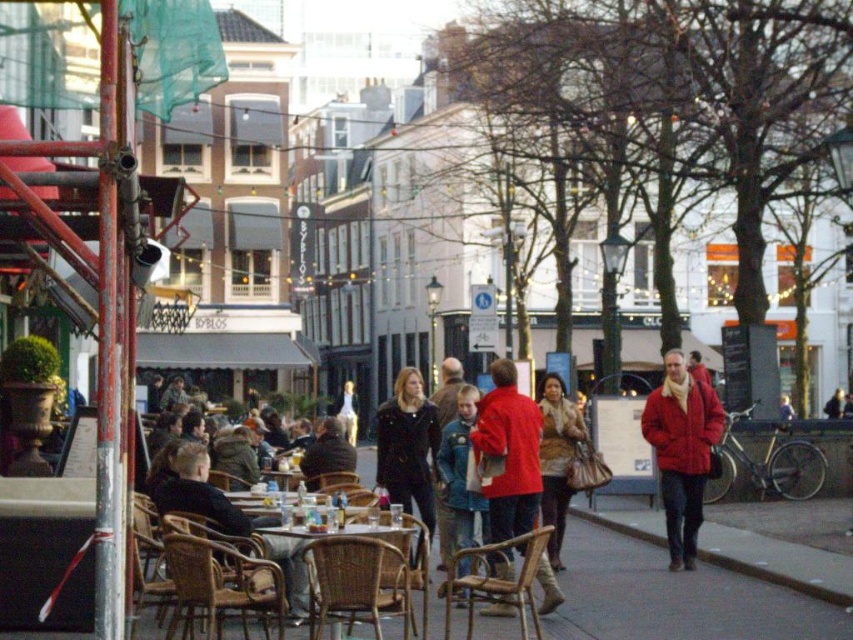
Is woven wood chair at center shorter than denim jacket at center?

Indeed, woven wood chair at center has a lesser height compared to denim jacket at center.

At what (x,y) coordinates should I click in order to perform the action: click on woven wood chair at center. Please return your answer as a coordinate pair (x, y). The image size is (853, 640). Looking at the image, I should click on (498, 582).

Locate an element on the screen. This screenshot has width=853, height=640. woven wood chair at center is located at coordinates (498, 582).

Is matte red jacket at center-right taller than woven wood chair at center?

Indeed, matte red jacket at center-right has a greater height compared to woven wood chair at center.

Who is more forward, (663, 394) or (540, 630)?

Point (540, 630)

Describe the element at coordinates (682, 451) in the screenshot. The width and height of the screenshot is (853, 640). I see `matte red jacket at center-right` at that location.

This screenshot has height=640, width=853. I want to click on matte red jacket at center-right, so click(682, 451).

Is woven brown chair at center above denim jacket at center?

No.

What do you see at coordinates (357, 582) in the screenshot?
I see `woven brown chair at center` at bounding box center [357, 582].

At what (x,y) coordinates should I click in order to perform the action: click on woven brown chair at center. Please return your answer as a coordinate pair (x, y). Looking at the image, I should click on (357, 582).